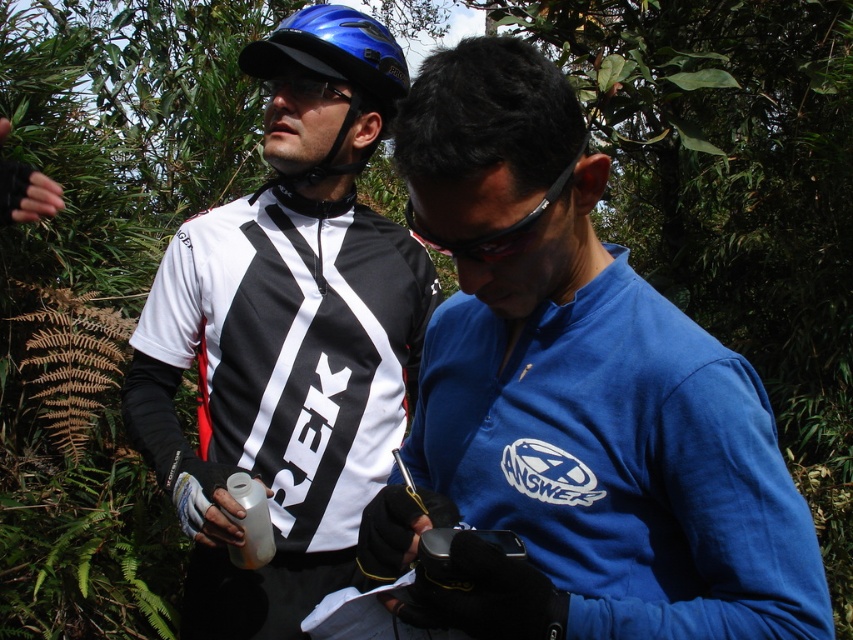
Question: Which point appears closest to the camera in this image?

Choices:
 (A) click(x=762, y=604)
 (B) click(x=305, y=100)

Answer: (A)

Question: Is blue matte helmet at upper center to the left of black plastic goggles at center from the viewer's perspective?

Choices:
 (A) yes
 (B) no

Answer: (A)

Question: Can you confirm if blue matte helmet at upper center is positioned to the left of black plastic goggles at center?

Choices:
 (A) no
 (B) yes

Answer: (B)

Question: Which point appears closest to the camera in this image?

Choices:
 (A) tap(335, 88)
 (B) tap(274, 452)
 (C) tap(379, 515)
 (D) tap(561, 186)

Answer: (D)

Question: Is blue matte helmet at upper center to the left of black plastic goggles at center from the viewer's perspective?

Choices:
 (A) no
 (B) yes

Answer: (B)

Question: Estimate the real-world distances between objects in this image. Which object is farther from the matte black jersey at center?

Choices:
 (A) blue fabric shirt at center
 (B) blue matte helmet at upper center

Answer: (A)